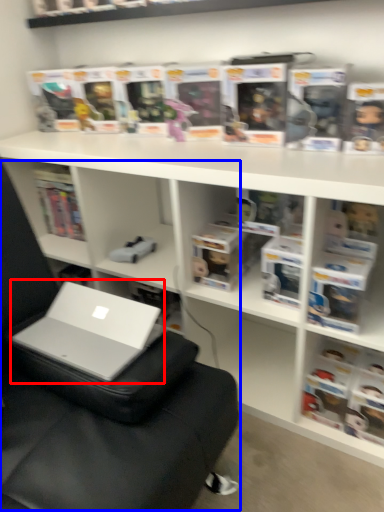
Question: Which point is further to the camera, laptop (highlighted by a red box) or bean bag chair (highlighted by a blue box)?

Choices:
 (A) laptop
 (B) bean bag chair

Answer: (A)